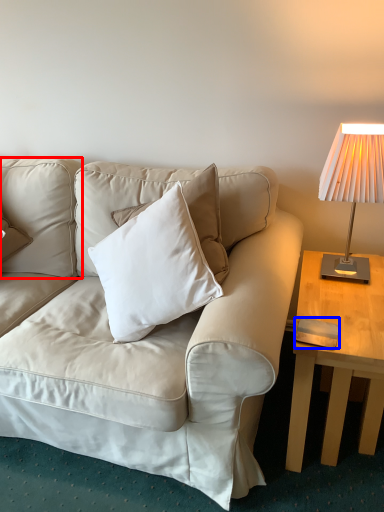
Question: Among these objects, which one is farthest to the camera, pillow (highlighted by a red box) or pad (highlighted by a blue box)?

Choices:
 (A) pillow
 (B) pad

Answer: (A)